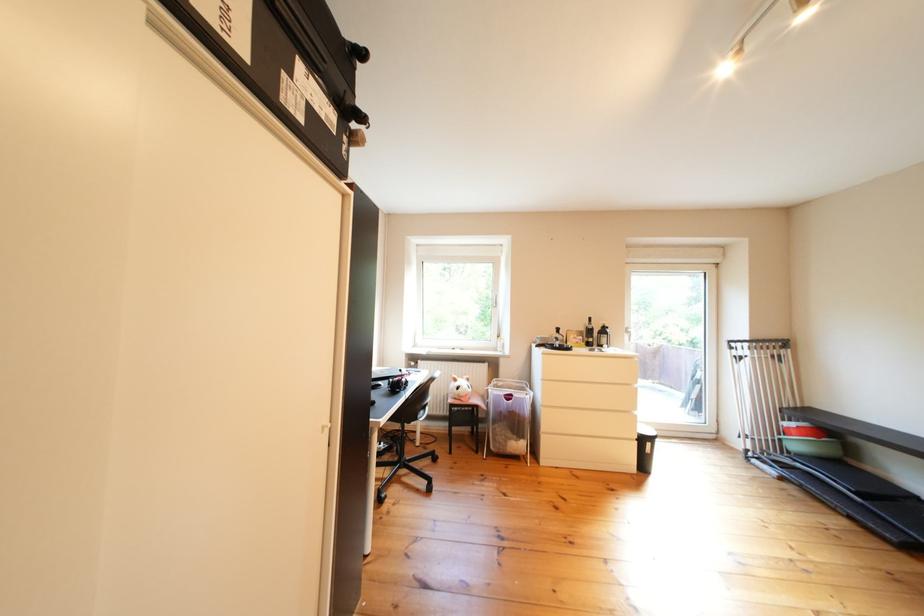
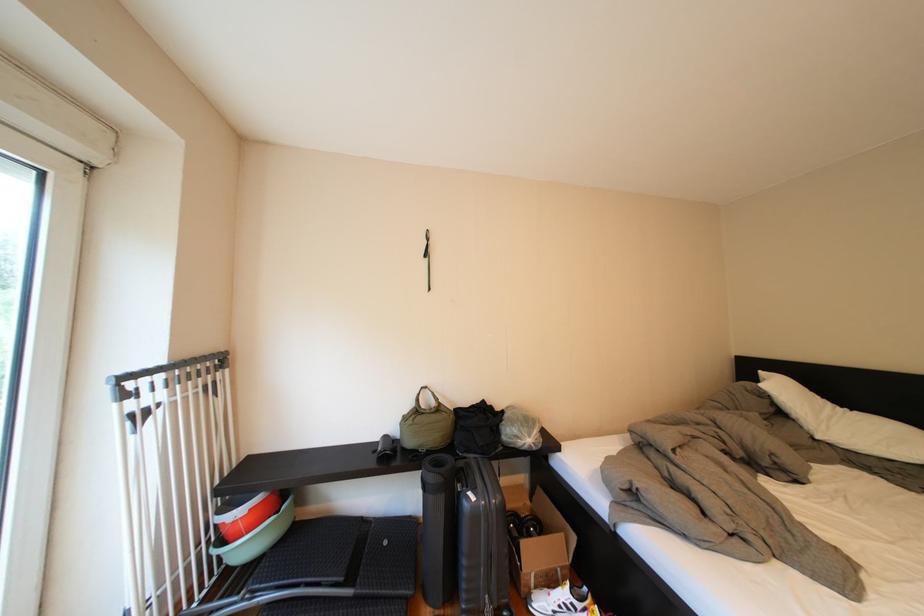
In the second image, find the point that corresponds to pixel 789 350 in the first image.

(224, 369)